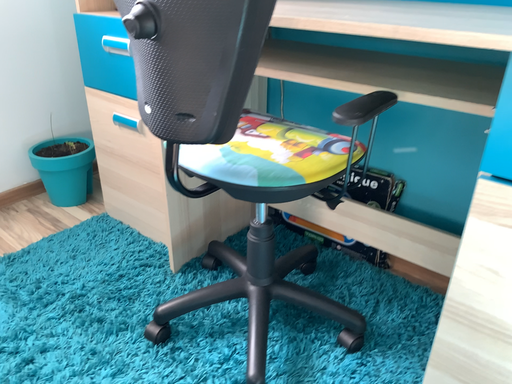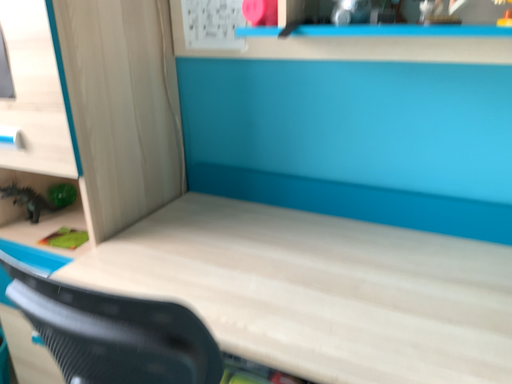
Question: Which way did the camera rotate in the video?

Choices:
 (A) rotated right
 (B) rotated left

Answer: (A)